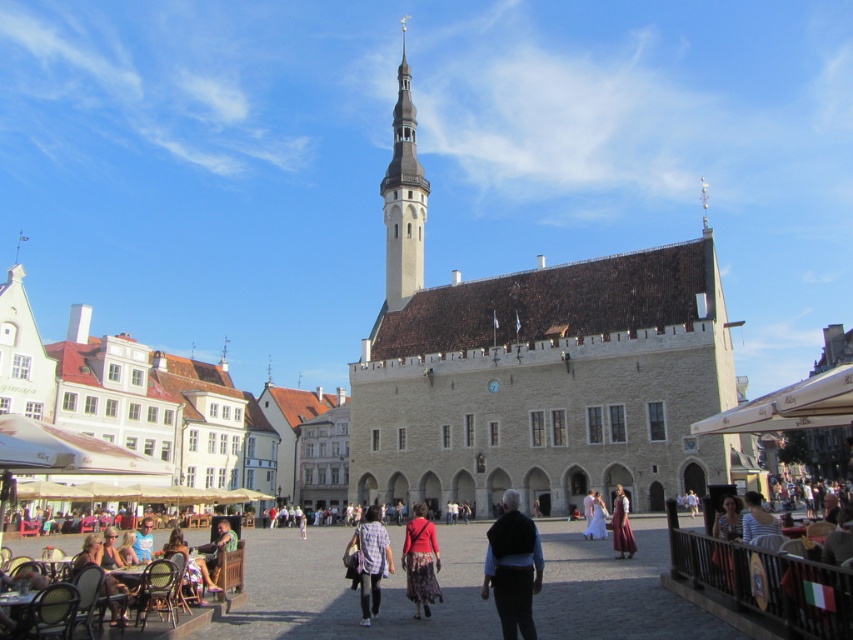
Does white stone tower at center appear under matte brown dress at center?

Incorrect, white stone tower at center is not positioned below matte brown dress at center.

Looking at this image, who is higher up, white stone tower at center or matte brown dress at center?

Positioned higher is white stone tower at center.

This screenshot has width=853, height=640. What do you see at coordinates (403, 196) in the screenshot?
I see `white stone tower at center` at bounding box center [403, 196].

The height and width of the screenshot is (640, 853). I want to click on white stone tower at center, so click(403, 196).

Does brown stone church at center appear under matte brown dress at center?

No.

Does brown stone church at center have a lesser height compared to matte brown dress at center?

No.

Which is behind, point (503, 490) or point (621, 516)?

The point (503, 490) is more distant.

At what (x,y) coordinates should I click in order to perform the action: click on brown stone church at center. Please return your answer as a coordinate pair (x, y). The height and width of the screenshot is (640, 853). Looking at the image, I should click on (537, 371).

Who is higher up, dark blue fabric vest at center or plaid shirt at center?

dark blue fabric vest at center is above.

Who is taller, dark blue fabric vest at center or plaid shirt at center?

With more height is plaid shirt at center.

Who is more distant from viewer, (508, 582) or (363, 620)?

Positioned behind is point (363, 620).

Where is `dark blue fabric vest at center`? Image resolution: width=853 pixels, height=640 pixels. dark blue fabric vest at center is located at coordinates (514, 568).